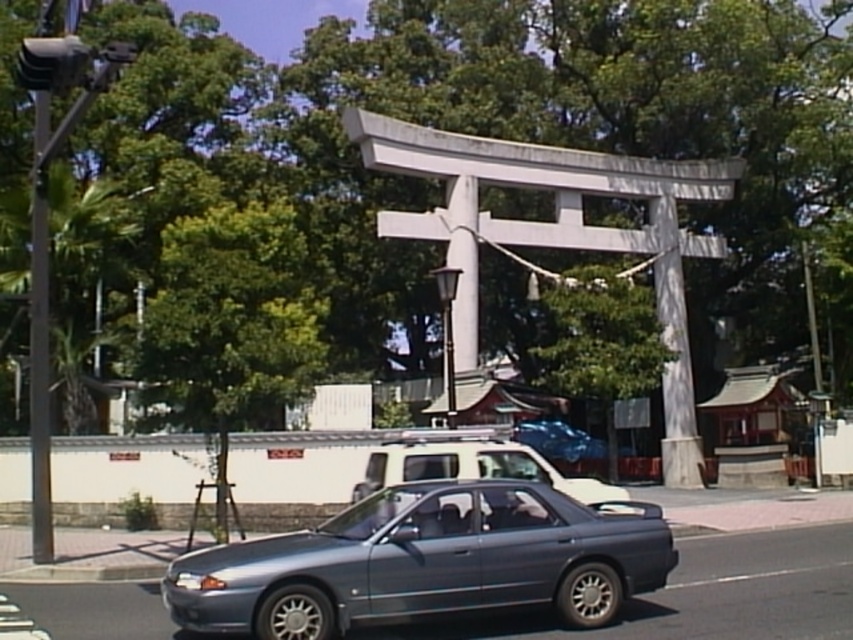
You are standing on the paved road in the street scene and want to locate the point at coordinates (x=427, y=561). Based on the scene description, where would this point be located?

The point at coordinates (x=427, y=561) is located on the satin metallic sedan at center.

You are a pedestrian standing on the sidewalk near the torii gate. You want to cross the road to reach a small shrine located behind the torii. The road has two cars, a satin metallic sedan at center and a metallic silver suv at center. What is the minimum distance you need to walk to cross the road safely between these two vehicles?

The minimum distance you need to walk to cross the road safely between the satin metallic sedan at center and the metallic silver suv at center is 4.27 meters, as that is the distance between them.